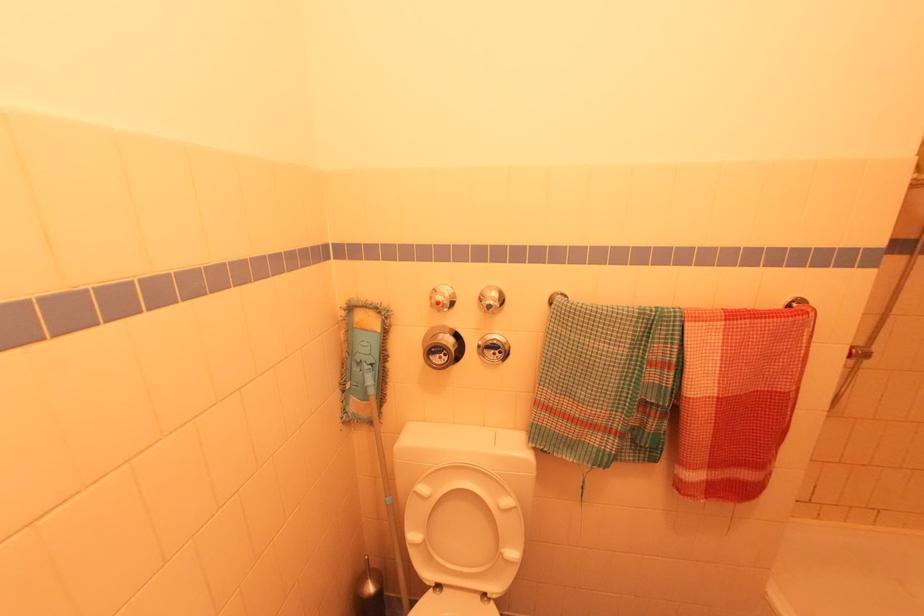
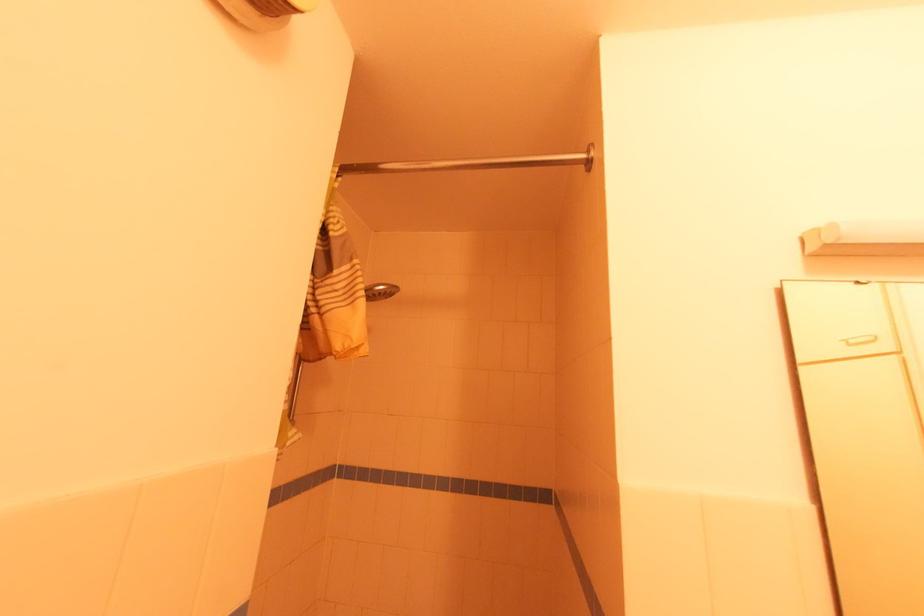
Question: How did the camera likely rotate?

Choices:
 (A) Left
 (B) Right
 (C) Up
 (D) Down

Answer: (B)